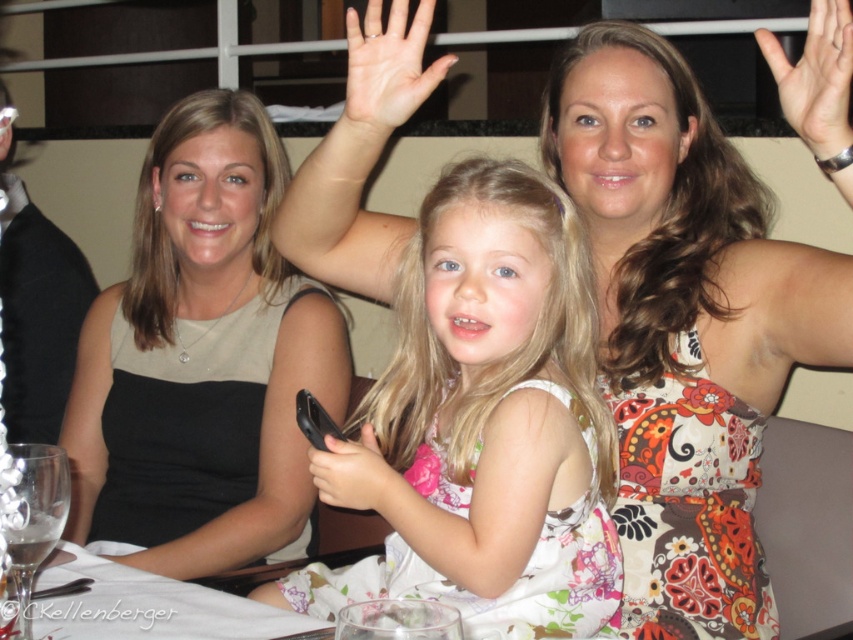
Question: Can you confirm if white matte hand at upper right is bigger than black matte phone at center?

Choices:
 (A) no
 (B) yes

Answer: (B)

Question: Which point appears farthest from the camera in this image?

Choices:
 (A) (479, 589)
 (B) (323, 170)

Answer: (B)

Question: Considering the relative positions of black matte phone at center and black plastic phone at center in the image provided, where is black matte phone at center located with respect to black plastic phone at center?

Choices:
 (A) below
 (B) above

Answer: (A)

Question: Estimate the real-world distances between objects in this image. Which object is farther from the matte black dress at center?

Choices:
 (A) pale skin at center
 (B) black plastic phone at center

Answer: (A)

Question: Which of the following is the closest to the observer?

Choices:
 (A) white matte hand at upper right
 (B) black plastic phone at center

Answer: (A)

Question: In this image, where is white floral dress at center located relative to black plastic phone at center?

Choices:
 (A) above
 (B) below

Answer: (B)